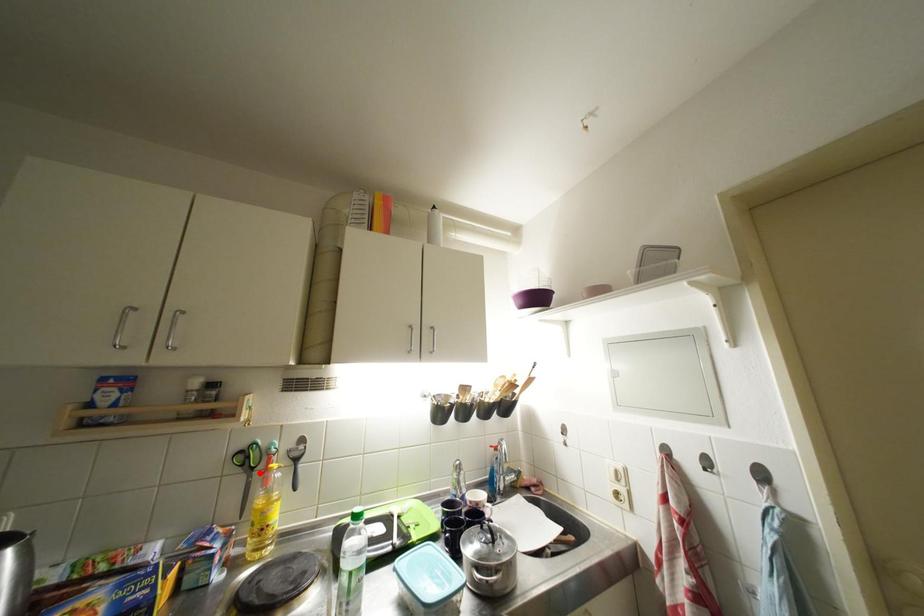
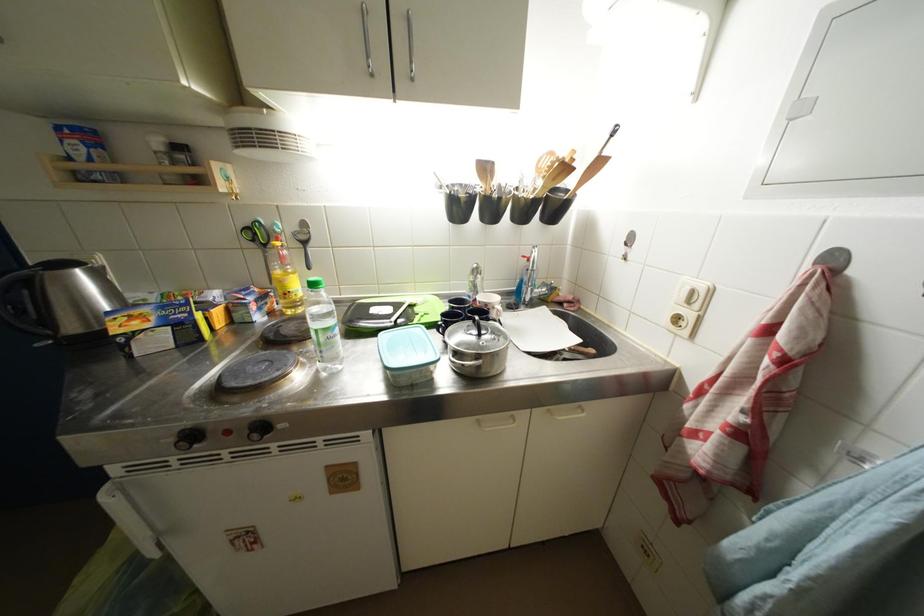
In the second image, find the point that corresponds to the highlighted location in the first image.

(272, 249)